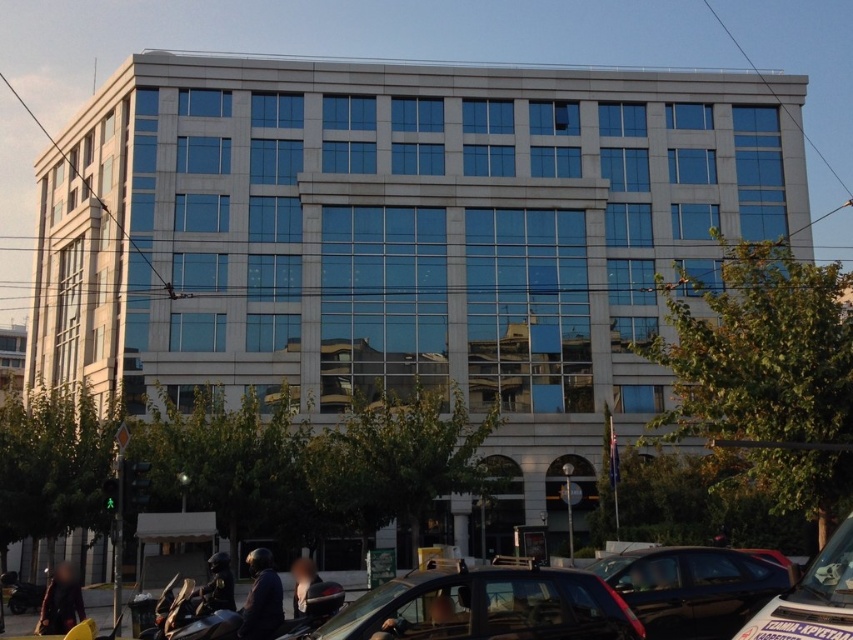
Question: Which point is closer to the camera?

Choices:
 (A) (764, 618)
 (B) (253, 557)
 (C) (222, 580)
 (D) (550, 636)

Answer: (A)

Question: Does metallic silver car at lower right appear over dark blue leather jacket at lower left?

Choices:
 (A) yes
 (B) no

Answer: (A)

Question: Which point appears farthest from the camera in this image?

Choices:
 (A) (639, 636)
 (B) (228, 561)
 (C) (753, 611)

Answer: (B)

Question: Observing the image, what is the correct spatial positioning of glossy black car at lower right in reference to shiny black helmet at lower center?

Choices:
 (A) above
 (B) below

Answer: (A)

Question: Is glossy black car at lower right behind metallic silver car at lower right?

Choices:
 (A) no
 (B) yes

Answer: (B)

Question: Estimate the real-world distances between objects in this image. Which object is farther from the matte black car at center?

Choices:
 (A) dark blue leather jacket at lower left
 (B) shiny black helmet at lower center
 (C) glossy black car at lower right

Answer: (B)